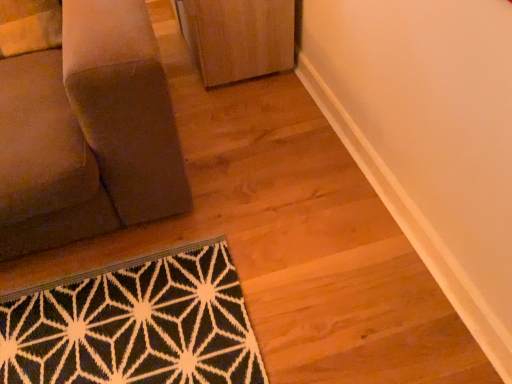
Locate an element on the screen. The width and height of the screenshot is (512, 384). suede-like brown cushion at lower left is located at coordinates (83, 125).

Describe the element at coordinates (83, 125) in the screenshot. This screenshot has width=512, height=384. I see `suede-like brown cushion at lower left` at that location.

At what (x,y) coordinates should I click in order to perform the action: click on suede-like brown cushion at lower left. Please return your answer as a coordinate pair (x, y). The image size is (512, 384). Looking at the image, I should click on (83, 125).